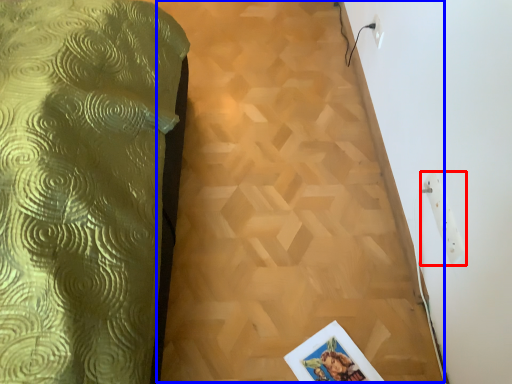
Question: Which of the following is the closest to the observer, electric outlet (highlighted by a red box) or plywood (highlighted by a blue box)?

Choices:
 (A) electric outlet
 (B) plywood

Answer: (A)